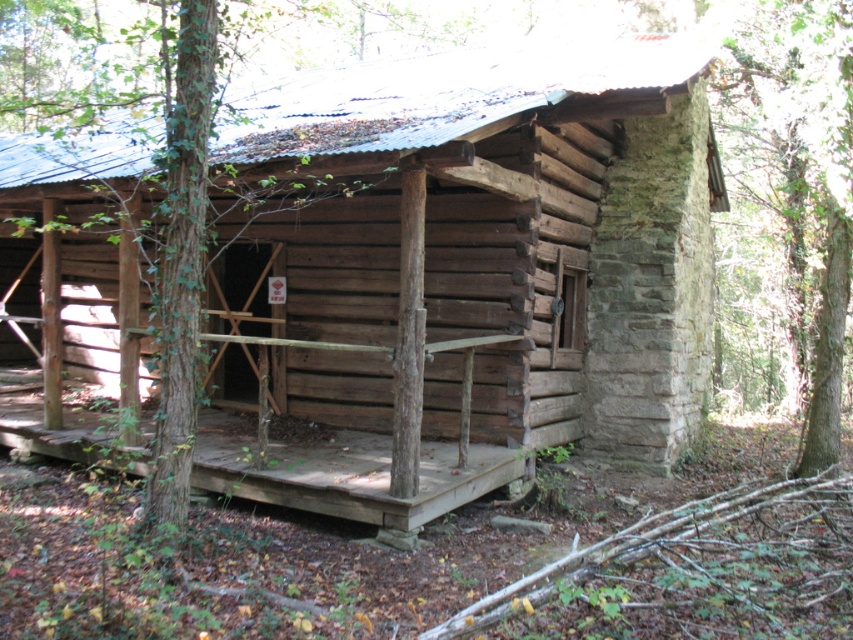
Does weathered wood cabin at center have a smaller size compared to green leafy tree at right?

Indeed, weathered wood cabin at center has a smaller size compared to green leafy tree at right.

Does point (526, 164) lie behind point (730, 64)?

No, (526, 164) is in front of (730, 64).

Does point (606, 288) come behind point (785, 385)?

No, it is not.

Identify the location of weathered wood cabin at center. The height and width of the screenshot is (640, 853). (512, 225).

Locate an element on the screen. The width and height of the screenshot is (853, 640). weathered wood cabin at center is located at coordinates (512, 225).

Is weathered wood cabin at center to the right of weathered wood porch at center from the viewer's perspective?

Result: Indeed, weathered wood cabin at center is positioned on the right side of weathered wood porch at center.

Which is in front, point (548, 246) or point (73, 419)?

Point (548, 246)

Image resolution: width=853 pixels, height=640 pixels. Find the location of `weathered wood cabin at center`. weathered wood cabin at center is located at coordinates (512, 225).

Who is shorter, green leafy tree at right or weathered wood porch at center?

Standing shorter between the two is weathered wood porch at center.

Does green leafy tree at right have a larger size compared to weathered wood porch at center?

Correct, green leafy tree at right is larger in size than weathered wood porch at center.

Find the location of a particular element. The width and height of the screenshot is (853, 640). green leafy tree at right is located at coordinates (787, 211).

At what (x,y) coordinates should I click in order to perform the action: click on green leafy tree at right. Please return your answer as a coordinate pair (x, y). This screenshot has width=853, height=640. Looking at the image, I should click on (787, 211).